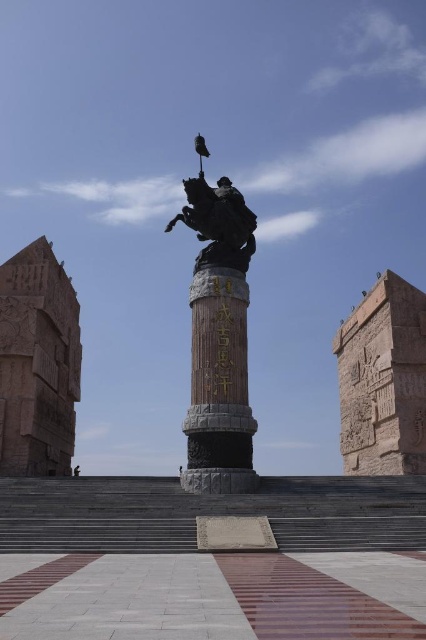
Does black polished stone pillar at center appear on the right side of polished bronze statue at center?

Indeed, black polished stone pillar at center is positioned on the right side of polished bronze statue at center.

Who is positioned more to the left, black polished stone pillar at center or polished bronze statue at center?

Positioned to the left is polished bronze statue at center.

Where is `black polished stone pillar at center`? The height and width of the screenshot is (640, 426). black polished stone pillar at center is located at coordinates (218, 387).

Where is `black polished stone pillar at center`? This screenshot has height=640, width=426. black polished stone pillar at center is located at coordinates (218, 387).